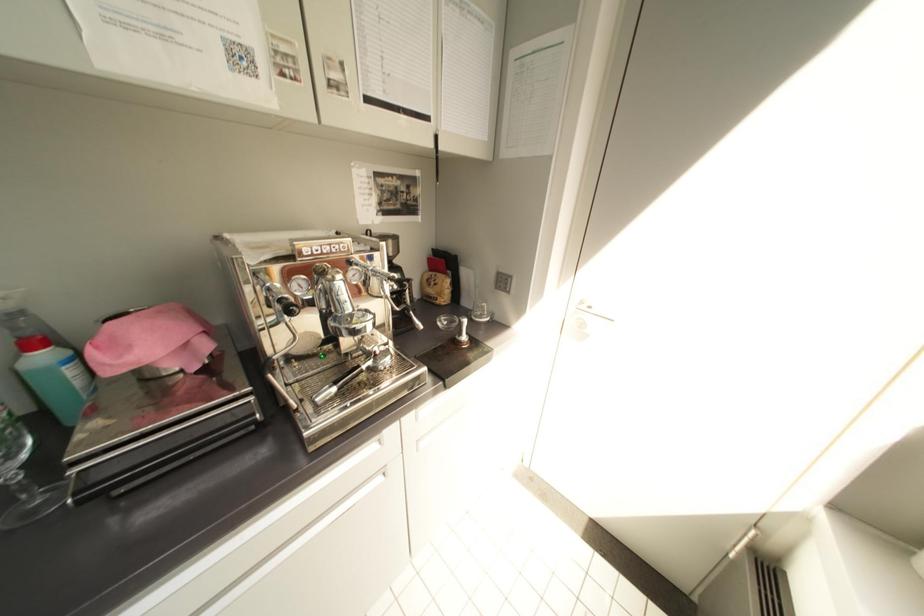
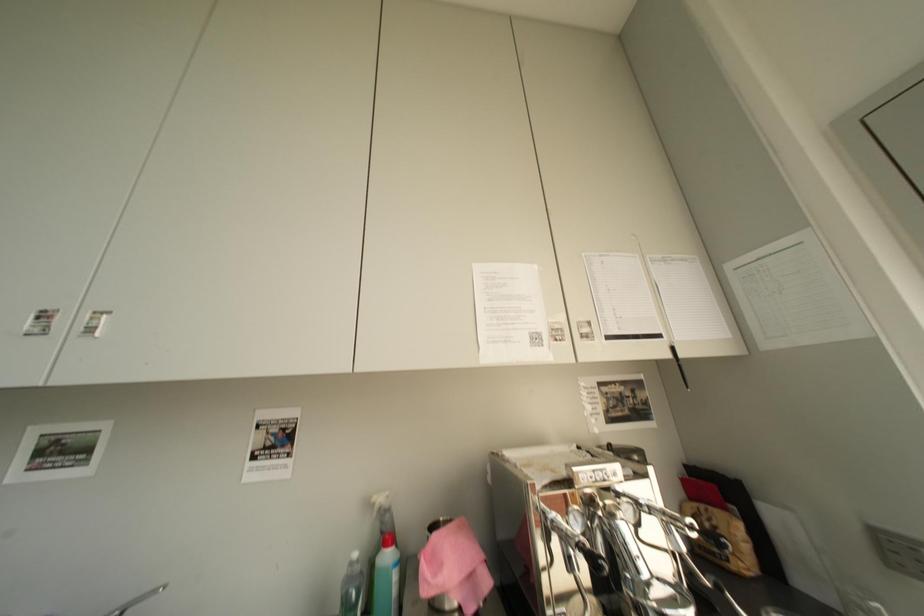
The first image is from the beginning of the video and the second image is from the end. How did the camera likely rotate when shooting the video?

The camera's rotation is toward left-up.